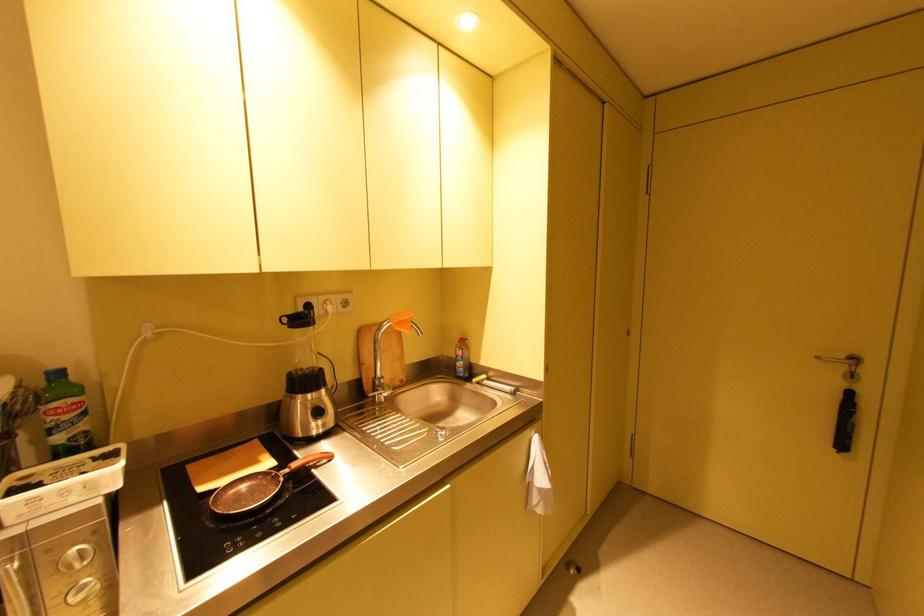
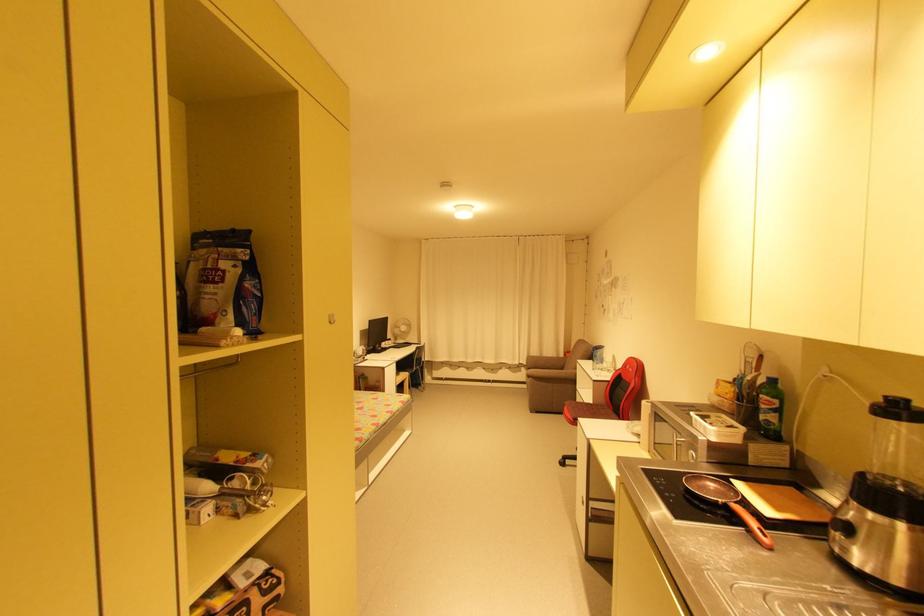
The point at (82,408) is marked in the first image. Where is the corresponding point in the second image?

(773, 406)